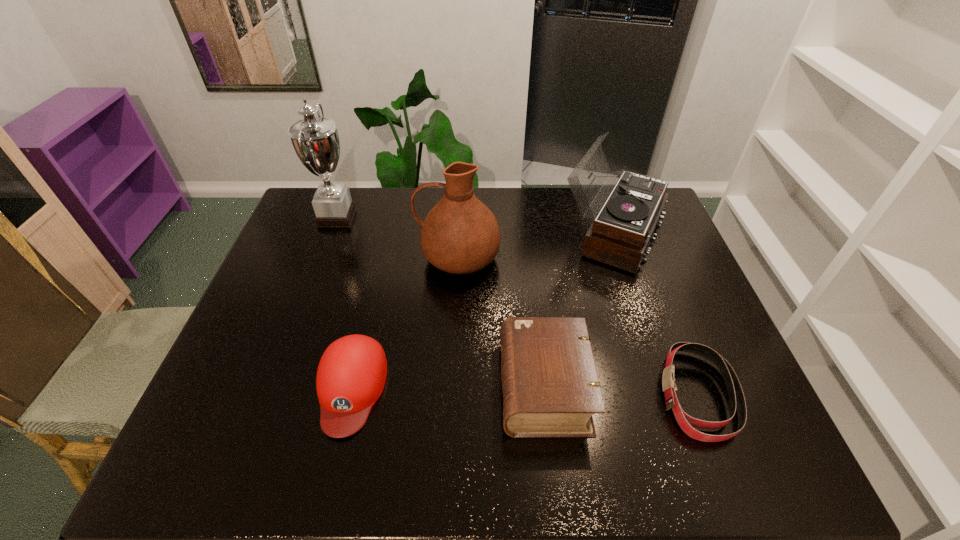
The width and height of the screenshot is (960, 540). In the image, there is a desktop. Find the location of `free space at the right edge`. free space at the right edge is located at coordinates (679, 390).

The image size is (960, 540). Identify the location of vacant space at the near left corner of the desktop. (197, 461).

Find the location of a particular element. The image size is (960, 540). empty location between the shortest object and the leftmost object is located at coordinates (517, 306).

I want to click on vacant point located between the fifth object from right to left and the fourth shortest object, so click(482, 311).

In order to click on vacant area that lies between the shortest object and the tallest object in this screenshot , I will do 517,306.

The height and width of the screenshot is (540, 960). I want to click on free area in between the fifth shortest object and the record player, so click(536, 246).

Identify the location of free spot between the fifth object from right to left and the Bible. (447, 387).

I want to click on blank region between the shortest object and the fourth shortest object, so click(656, 314).

This screenshot has width=960, height=540. I want to click on vacant point located between the second tallest object and the Bible, so click(x=501, y=322).

Find the location of a particular element. The height and width of the screenshot is (540, 960). free space between the Bible and the pitcher is located at coordinates (501, 322).